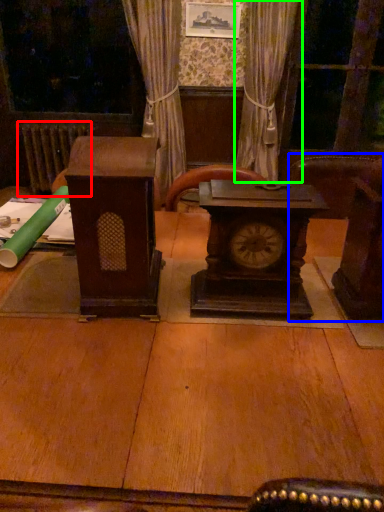
Question: Which object is the closest to the radiator (highlighted by a red box)? Choose among these: furniture (highlighted by a blue box) or curtain (highlighted by a green box).

Choices:
 (A) furniture
 (B) curtain

Answer: (B)